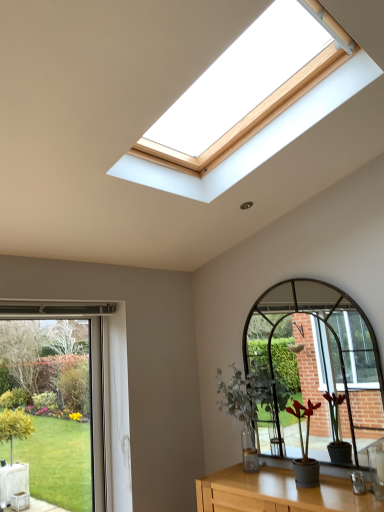
The width and height of the screenshot is (384, 512). What do you see at coordinates (278, 493) in the screenshot?
I see `wooden table at lower center` at bounding box center [278, 493].

You are a GUI agent. You are given a task and a screenshot of the screen. Output one action in this format:
    pyautogui.click(x=<x>, y=<y>)
    Task: Click on the wooden table at lower center
    This screenshot has width=384, height=512.
    Given the screenshot: What is the action you would take?
    pyautogui.click(x=278, y=493)

At what (x,y) coordinates should I click in order to perform the action: click on green glass window at lower left. Please return your answer as a coordinate pair (x, y). This screenshot has width=384, height=512. Looking at the image, I should click on (52, 405).

Is point (98, 323) closer to camera compared to point (325, 490)?

No, (98, 323) is behind (325, 490).

Which object is positioned more to the left, green glass window at lower left or wooden table at lower center?

green glass window at lower left.

From the picture: From a real-world perspective, is green glass window at lower left physically below wooden table at lower center?

No, from a real-world perspective, green glass window at lower left is not beneath wooden table at lower center.

Can you confirm if green glass window at lower left is wider than wooden table at lower center?

In fact, green glass window at lower left might be narrower than wooden table at lower center.

Is green matte plant at center, the second houseplant positioned from the back, facing away from green glass window at lower left?

No, green glass window at lower left is not at the back of green matte plant at center, the second houseplant positioned from the back.

Is green matte plant at center, which is counted as the 1th houseplant, starting from the right, far from green glass window at lower left?

Indeed, green matte plant at center, which is counted as the 1th houseplant, starting from the right, is not near green glass window at lower left.

Can you confirm if green matte plant at center, the 2th houseplant in the left-to-right sequence, is taller than green glass window at lower left?

No, green matte plant at center, the 2th houseplant in the left-to-right sequence, is not taller than green glass window at lower left.

The image size is (384, 512). Identify the location of window above the green matte plant at center, which is the first houseplant in front-to-back order (from the image's perspective). (52, 405).

From the image's perspective, which object appears higher, green matte plant at center, the 2th houseplant in the left-to-right sequence, or wooden table at lower center?

green matte plant at center, the 2th houseplant in the left-to-right sequence, appears higher in the image.

Is green matte plant at center, which is counted as the 1th houseplant, starting from the right, positioned beyond the bounds of wooden table at lower center?

Yes, green matte plant at center, which is counted as the 1th houseplant, starting from the right, is outside of wooden table at lower center.

Is the position of green matte plant at center, the 2th houseplant in the left-to-right sequence, less distant than that of wooden table at lower center?

No, green matte plant at center, the 2th houseplant in the left-to-right sequence, is further to the viewer.

Could you measure the distance between green matte plant at center, the 2th houseplant in the left-to-right sequence, and wooden table at lower center?

green matte plant at center, the 2th houseplant in the left-to-right sequence, and wooden table at lower center are 10.40 inches apart.

What's the angular difference between green matte plant at center, which is the 2th houseplant from right to left, and green matte plant at center, which is the first houseplant in front-to-back order,'s facing directions?

They differ by 0.723 degrees in their facing directions.

From the image's perspective, is green matte plant at center, which is the 2th houseplant from right to left, above or below green matte plant at center, the second houseplant positioned from the back?

green matte plant at center, which is the 2th houseplant from right to left, is situated higher than green matte plant at center, the second houseplant positioned from the back, in the image.

Is point (252, 444) closer or farther from the camera than point (309, 478)?

Point (252, 444) is farther from the camera than point (309, 478).

Consider the image. Who is taller, green matte plant at center, which appears as the 1th houseplant when viewed from the left, or green matte plant at center, which is counted as the 1th houseplant, starting from the right?

green matte plant at center, which appears as the 1th houseplant when viewed from the left.

How much distance is there between green glass window at lower left and green matte plant at center, the second houseplant positioned from the back?

green glass window at lower left and green matte plant at center, the second houseplant positioned from the back, are 2.91 meters apart.

The height and width of the screenshot is (512, 384). What are the coordinates of `the 2nd houseplant directly beneath the green glass window at lower left (from a real-world perspective)` in the screenshot? It's located at click(x=305, y=447).

Is point (103, 499) closer to viewer compared to point (296, 471)?

That is False.

Considering the sizes of objects wooden table at lower center and green glass window at lower left in the image provided, who is shorter, wooden table at lower center or green glass window at lower left?

With less height is wooden table at lower center.

Considering their positions, is wooden table at lower center located in front of or behind green glass window at lower left?

Clearly, wooden table at lower center is in front of green glass window at lower left.

How far apart are wooden table at lower center and green glass window at lower left?

They are 2.19 meters apart.

Considering the relative sizes of wooden table at lower center and green glass window at lower left in the image provided, is wooden table at lower center smaller than green glass window at lower left?

No, wooden table at lower center is not smaller than green glass window at lower left.

Between point (238, 511) and point (298, 478), which one is positioned in front?

The point (238, 511) is closer.

In terms of size, does wooden table at lower center appear bigger or smaller than green matte plant at center, which is the first houseplant in front-to-back order?

Clearly, wooden table at lower center is larger in size than green matte plant at center, which is the first houseplant in front-to-back order.

Can you tell me how much wooden table at lower center and green matte plant at center, the 2th houseplant in the left-to-right sequence, differ in facing direction?

The facing directions of wooden table at lower center and green matte plant at center, the 2th houseplant in the left-to-right sequence, are 1.15 degrees apart.

Consider the image. From the image's perspective, is wooden table at lower center located above green matte plant at center, which is counted as the 1th houseplant, starting from the right?

No, from the image's perspective, wooden table at lower center is not on top of green matte plant at center, which is counted as the 1th houseplant, starting from the right.

This screenshot has height=512, width=384. In order to click on table in front of the green glass window at lower left in this screenshot , I will do `click(278, 493)`.

This screenshot has width=384, height=512. In order to click on window behind the green matte plant at center, which is the first houseplant in front-to-back order in this screenshot , I will do `click(52, 405)`.

Which object lies further to the anchor point green glass window at lower left, green matte plant at center, which is the first houseplant in front-to-back order, or wooden table at lower center?

The object further to green glass window at lower left is green matte plant at center, which is the first houseplant in front-to-back order.

Based on their spatial positions, is wooden table at lower center or green glass window at lower left closer to green matte plant at center, the second houseplant positioned from the back?

wooden table at lower center.

Estimate the real-world distances between objects in this image. Which object is further from green glass window at lower left, wooden table at lower center or green matte plant at center, the 2th houseplant in the left-to-right sequence?

The object further to green glass window at lower left is green matte plant at center, the 2th houseplant in the left-to-right sequence.

Which object lies further to the anchor point green matte plant at center, which ranks as the first houseplant in back-to-front order, green matte plant at center, the 2th houseplant in the left-to-right sequence, or green glass window at lower left?

green glass window at lower left is further to green matte plant at center, which ranks as the first houseplant in back-to-front order.

In the scene shown: Based on their spatial positions, is green glass window at lower left or wooden table at lower center closer to green matte plant at center, which is the first houseplant in front-to-back order?

wooden table at lower center is closer to green matte plant at center, which is the first houseplant in front-to-back order.

Which object lies nearer to the anchor point green glass window at lower left, green matte plant at center, the 2th houseplant in the left-to-right sequence, or green matte plant at center, marked as the 2th houseplant in a front-to-back arrangement?

Among the two, green matte plant at center, marked as the 2th houseplant in a front-to-back arrangement, is located nearer to green glass window at lower left.

When comparing their distances from green glass window at lower left, does wooden table at lower center or green matte plant at center, marked as the 2th houseplant in a front-to-back arrangement, seem closer?

green matte plant at center, marked as the 2th houseplant in a front-to-back arrangement, lies closer to green glass window at lower left than the other object.

Which object lies further to the anchor point green matte plant at center, marked as the 2th houseplant in a front-to-back arrangement, green matte plant at center, which is counted as the 1th houseplant, starting from the right, or wooden table at lower center?

Among the two, wooden table at lower center is located further to green matte plant at center, marked as the 2th houseplant in a front-to-back arrangement.

The width and height of the screenshot is (384, 512). What are the coordinates of `houseplant between wooden table at lower center and green matte plant at center, which ranks as the first houseplant in back-to-front order, from front to back` in the screenshot? It's located at (305, 447).

Where is `houseplant between green glass window at lower left and green matte plant at center, which is counted as the 1th houseplant, starting from the right`? The height and width of the screenshot is (512, 384). houseplant between green glass window at lower left and green matte plant at center, which is counted as the 1th houseplant, starting from the right is located at coordinates (251, 404).

Locate an element on the screen. houseplant between green glass window at lower left and wooden table at lower center in the horizontal direction is located at coordinates (251, 404).

Where is `table situated between green glass window at lower left and green matte plant at center, the second houseplant positioned from the back, from left to right`? table situated between green glass window at lower left and green matte plant at center, the second houseplant positioned from the back, from left to right is located at coordinates (278, 493).